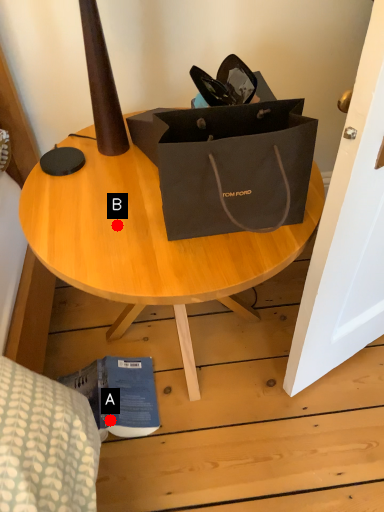
Question: Two points are circled on the image, labeled by A and B beside each circle. Which point is closer to the camera?

Choices:
 (A) A is closer
 (B) B is closer

Answer: (B)